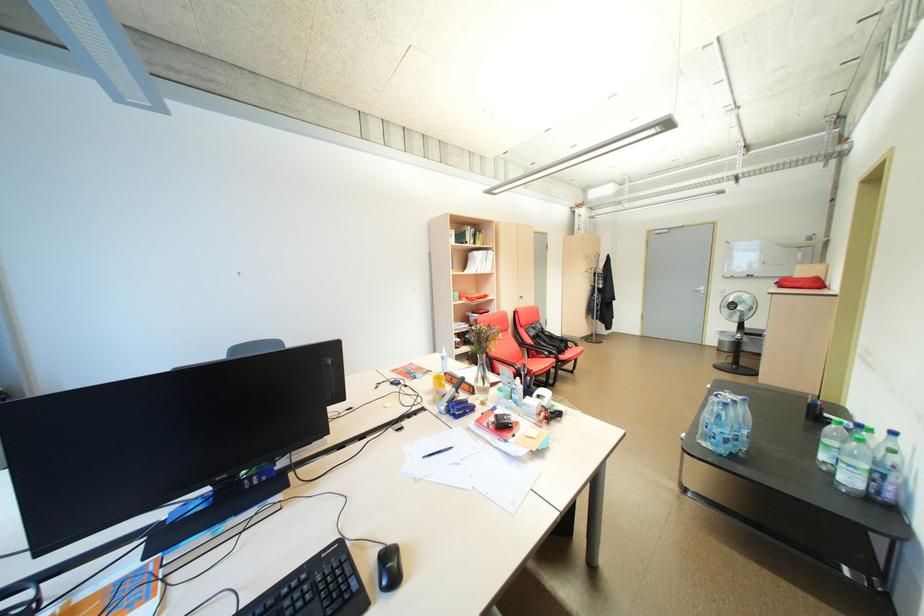
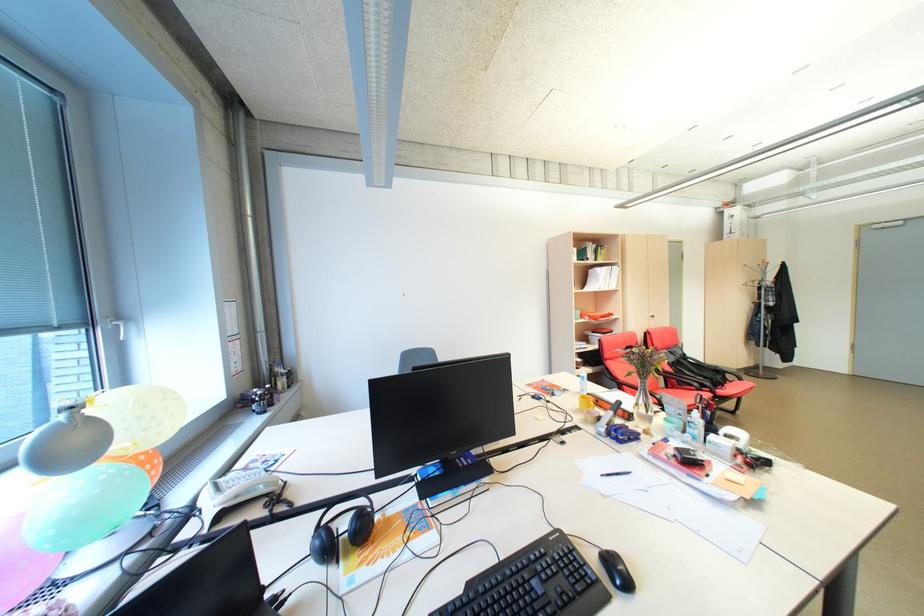
Find the pixel in the second image that matches (x=464, y=390) in the first image.

(621, 413)